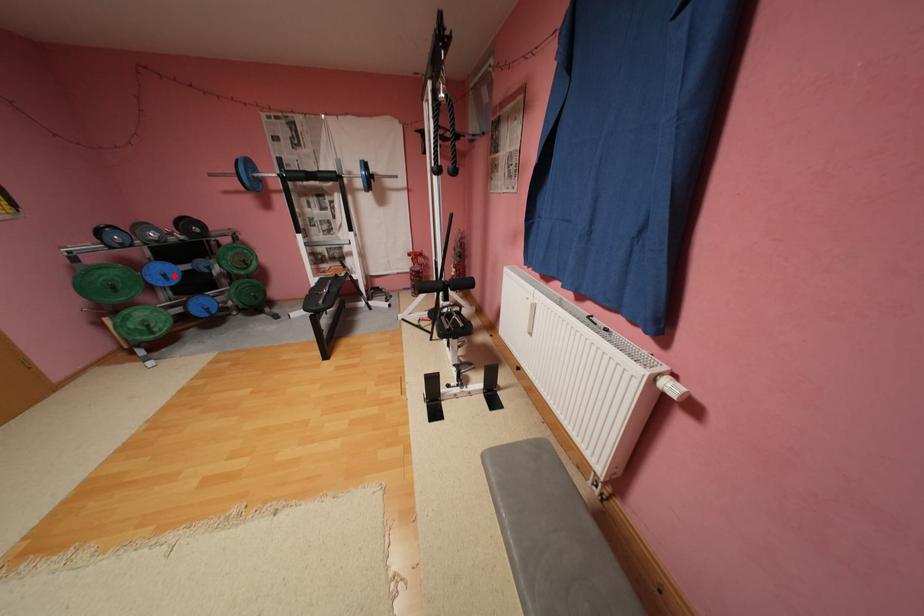
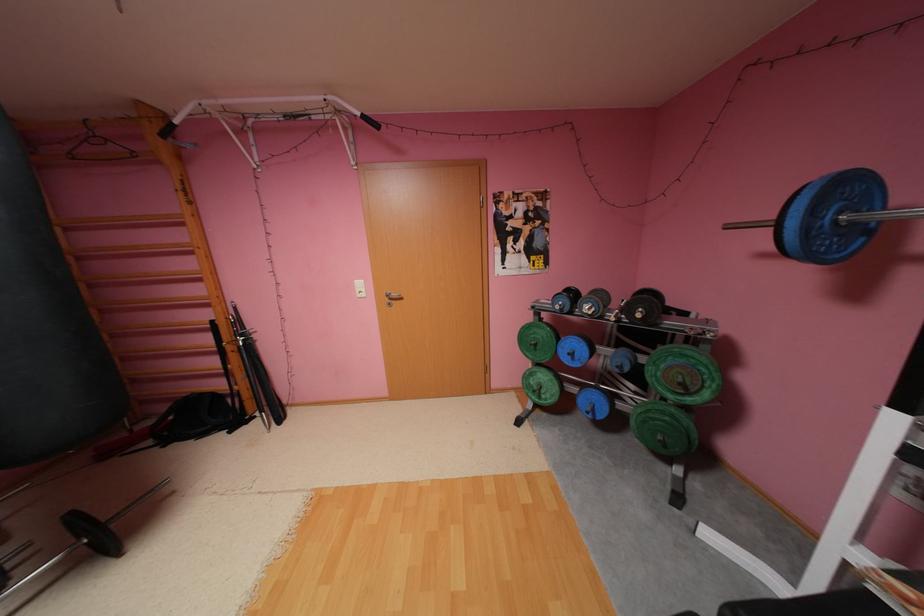
In the second image, find the point that corresponds to the highlighted location in the first image.

(580, 354)